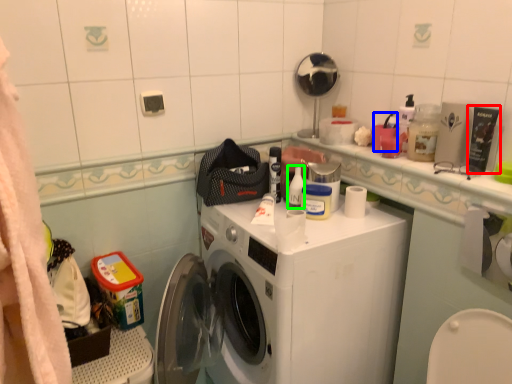
Question: Which object is the farthest from toiletry (highlighted by a red box)? Choose among these: toiletry (highlighted by a blue box) or toiletry (highlighted by a green box).

Choices:
 (A) toiletry
 (B) toiletry

Answer: (B)